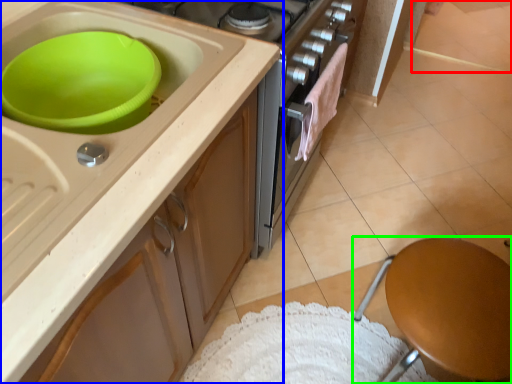
Question: Considering the real-world distances, which object is closest to tile (highlighted by a red box)? cabinetry (highlighted by a blue box) or furniture (highlighted by a green box).

Choices:
 (A) cabinetry
 (B) furniture

Answer: (B)